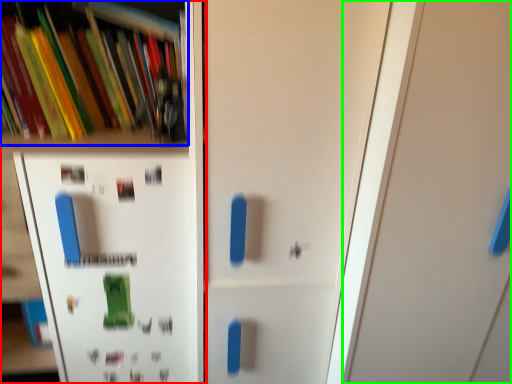
Question: Which object is the closest to the shelf (highlighted by a red box)? Choose among these: book (highlighted by a blue box) or door (highlighted by a green box).

Choices:
 (A) book
 (B) door

Answer: (A)